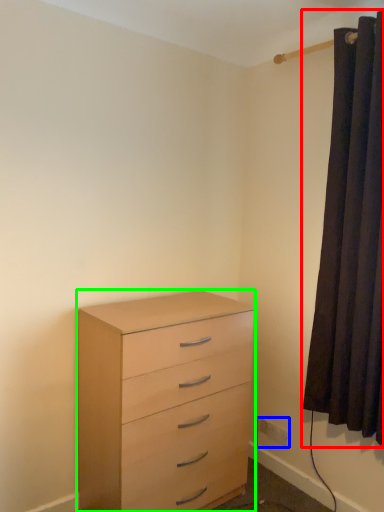
Question: Based on their relative distances, which object is nearer to curtain (highlighted by a red box)? Choose from electric outlet (highlighted by a blue box) and chest of drawers (highlighted by a green box).

Choices:
 (A) electric outlet
 (B) chest of drawers

Answer: (B)